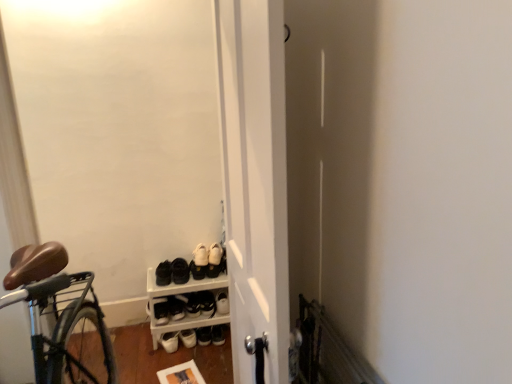
Question: Considering the relative positions of white matte door at center and black leather shoe at center, arranged as the 4th footwear when viewed from the left, in the image provided, is white matte door at center to the right of black leather shoe at center, arranged as the 4th footwear when viewed from the left, from the viewer's perspective?

Choices:
 (A) yes
 (B) no

Answer: (A)

Question: Is white matte door at center not close to black leather shoe at center, arranged as the 4th footwear when viewed from the left?

Choices:
 (A) yes
 (B) no

Answer: (A)

Question: Can you confirm if white matte door at center is wider than black leather shoe at center, which ranks as the 2th footwear in right-to-left order?

Choices:
 (A) yes
 (B) no

Answer: (B)

Question: Considering the relative positions of white matte door at center and black leather shoe at center, arranged as the 4th footwear when viewed from the left, in the image provided, is white matte door at center to the left of black leather shoe at center, arranged as the 4th footwear when viewed from the left, from the viewer's perspective?

Choices:
 (A) yes
 (B) no

Answer: (B)

Question: From the image's perspective, is white matte door at center located beneath black leather shoe at center, which ranks as the 2th footwear in right-to-left order?

Choices:
 (A) no
 (B) yes

Answer: (A)

Question: Does white matte door at center have a lesser width compared to black leather shoe at center, which ranks as the 2th footwear in right-to-left order?

Choices:
 (A) no
 (B) yes

Answer: (B)

Question: Is black matte shoes at center, the 4th footwear in the right-to-left sequence, surrounded by black matte sneakers at lower left, which is the fifth footwear in right-to-left order?

Choices:
 (A) no
 (B) yes

Answer: (A)

Question: From the image's perspective, is black matte sneakers at lower left, which is counted as the 1th footwear, starting from the left, on black matte shoes at center, arranged as the 2th footwear when viewed from the left?

Choices:
 (A) yes
 (B) no

Answer: (B)

Question: Considering the relative positions of black matte sneakers at lower left, which is the fifth footwear in right-to-left order, and black matte shoes at center, arranged as the 2th footwear when viewed from the left, in the image provided, is black matte sneakers at lower left, which is the fifth footwear in right-to-left order, behind black matte shoes at center, arranged as the 2th footwear when viewed from the left,?

Choices:
 (A) yes
 (B) no

Answer: (B)

Question: From a real-world perspective, does black matte sneakers at lower left, which is the fifth footwear in right-to-left order, stand above black matte shoes at center, arranged as the 2th footwear when viewed from the left?

Choices:
 (A) yes
 (B) no

Answer: (B)

Question: Is black matte sneakers at lower left, which is counted as the 1th footwear, starting from the left, oriented away from black matte shoes at center, the 4th footwear in the right-to-left sequence?

Choices:
 (A) yes
 (B) no

Answer: (B)

Question: From a real-world perspective, is black matte sneakers at lower left, which is the fifth footwear in right-to-left order, physically below black matte shoes at center, the 4th footwear in the right-to-left sequence?

Choices:
 (A) no
 (B) yes

Answer: (B)

Question: Is white plastic shoe rack at lower center at the left side of black leather shoe at center, which ranks as the 2th footwear in right-to-left order?

Choices:
 (A) no
 (B) yes

Answer: (B)